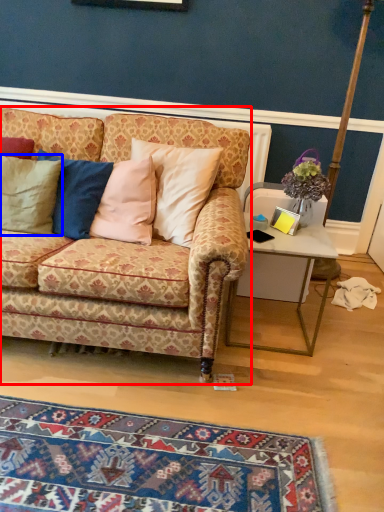
Question: Which object is closer to the camera taking this photo, studio couch (highlighted by a red box) or pillow (highlighted by a blue box)?

Choices:
 (A) studio couch
 (B) pillow

Answer: (A)